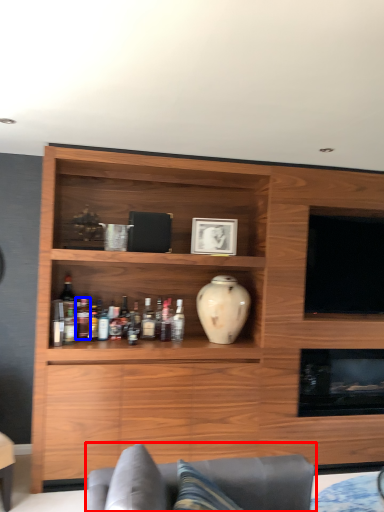
Question: Among these objects, which one is nearest to the camera, studio couch (highlighted by a red box) or bottle (highlighted by a blue box)?

Choices:
 (A) studio couch
 (B) bottle

Answer: (A)